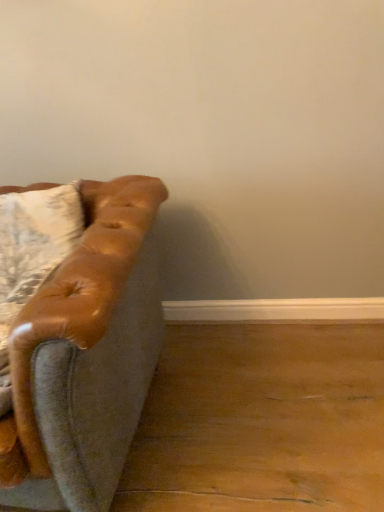
Describe the element at coordinates (33, 247) in the screenshot. Image resolution: width=384 pixels, height=512 pixels. I see `leather pillow at left` at that location.

Locate an element on the screen. The height and width of the screenshot is (512, 384). leather pillow at left is located at coordinates (33, 247).

What do you see at coordinates (75, 337) in the screenshot? I see `matte brown leather couch at left` at bounding box center [75, 337].

This screenshot has width=384, height=512. Identify the location of matte brown leather couch at left. (75, 337).

Find the location of a particular element. Image resolution: width=384 pixels, height=512 pixels. leather pillow at left is located at coordinates (33, 247).

Considering the positions of objects leather pillow at left and matte brown leather couch at left in the image provided, who is more to the right, leather pillow at left or matte brown leather couch at left?

From the viewer's perspective, leather pillow at left appears more on the right side.

Is leather pillow at left further to camera compared to matte brown leather couch at left?

That is True.

Between point (42, 254) and point (41, 337), which one is positioned in front?

Positioned in front is point (41, 337).

From the image's perspective, relative to matte brown leather couch at left, is leather pillow at left above or below?

leather pillow at left is above matte brown leather couch at left.

From a real-world perspective, who is located lower, leather pillow at left or matte brown leather couch at left?

matte brown leather couch at left, from a real-world perspective.

Can you confirm if leather pillow at left is thinner than matte brown leather couch at left?

Yes.

Considering the sizes of objects leather pillow at left and matte brown leather couch at left in the image provided, who is taller, leather pillow at left or matte brown leather couch at left?

matte brown leather couch at left.

Does leather pillow at left have a larger size compared to matte brown leather couch at left?

No.

Would you say leather pillow at left is outside matte brown leather couch at left?

No.

Looking at this image, is leather pillow at left next to matte brown leather couch at left and touching it?

leather pillow at left and matte brown leather couch at left are not in contact.

Is leather pillow at left positioned with its back to matte brown leather couch at left?

Correct, leather pillow at left is looking away from matte brown leather couch at left.

Identify the location of pillow positioned vertically above the matte brown leather couch at left (from a real-world perspective). (33, 247).

Considering the relative positions of matte brown leather couch at left and leather pillow at left in the image provided, is matte brown leather couch at left to the left or to the right of leather pillow at left?

Based on their positions, matte brown leather couch at left is located to the left of leather pillow at left.

Considering the relative positions of matte brown leather couch at left and leather pillow at left in the image provided, is matte brown leather couch at left behind leather pillow at left?

No, matte brown leather couch at left is in front of leather pillow at left.

Which is closer, (120,202) or (50,254)?

Point (120,202) is positioned closer to the camera compared to point (50,254).

From the image's perspective, which is below, matte brown leather couch at left or leather pillow at left?

matte brown leather couch at left.

From a real-world perspective, is matte brown leather couch at left located higher than leather pillow at left?

Actually, matte brown leather couch at left is physically below leather pillow at left in the real world.

Considering the relative sizes of matte brown leather couch at left and leather pillow at left in the image provided, is matte brown leather couch at left wider than leather pillow at left?

Yes, matte brown leather couch at left is wider than leather pillow at left.

In terms of height, does matte brown leather couch at left look taller or shorter compared to leather pillow at left?

In the image, matte brown leather couch at left appears to be taller than leather pillow at left.

Who is bigger, matte brown leather couch at left or leather pillow at left?

matte brown leather couch at left.

Is matte brown leather couch at left spatially inside leather pillow at left, or outside of it?

matte brown leather couch at left is not inside leather pillow at left, it's outside.

Are matte brown leather couch at left and leather pillow at left located far from each other?

No, matte brown leather couch at left is not far from leather pillow at left.

Is matte brown leather couch at left aimed at leather pillow at left?

Yes, matte brown leather couch at left is facing leather pillow at left.

In the scene shown: What's the angular difference between matte brown leather couch at left and leather pillow at left's facing directions?

matte brown leather couch at left and leather pillow at left are facing 1.27 degrees away from each other.

Find the location of a particular element. Image resolution: width=384 pixels, height=512 pixels. pillow lying above the matte brown leather couch at left (from the image's perspective) is located at coordinates (33, 247).

You are a GUI agent. You are given a task and a screenshot of the screen. Output one action in this format:
    pyautogui.click(x=<x>, y=<y>)
    Task: Click on the studio couch below the leather pillow at left (from the image's perspective)
    The height and width of the screenshot is (512, 384).
    Given the screenshot: What is the action you would take?
    pyautogui.click(x=75, y=337)

I want to click on pillow above the matte brown leather couch at left (from the image's perspective), so click(x=33, y=247).